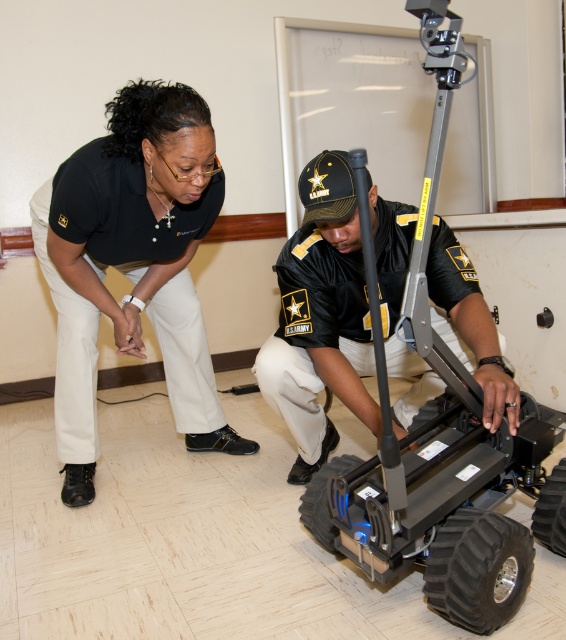
Question: Which point is closer to the camera taking this photo?

Choices:
 (A) (123, 323)
 (B) (435, 392)

Answer: (B)

Question: Which of the following is the farthest from the observer?

Choices:
 (A) black matte uniform at center
 (B) black uniform at left

Answer: (B)

Question: Can you confirm if black uniform at left is positioned to the left of black matte uniform at center?

Choices:
 (A) yes
 (B) no

Answer: (A)

Question: Is black uniform at left further to camera compared to black matte uniform at center?

Choices:
 (A) yes
 (B) no

Answer: (A)

Question: Does black uniform at left have a greater width compared to black matte uniform at center?

Choices:
 (A) yes
 (B) no

Answer: (A)